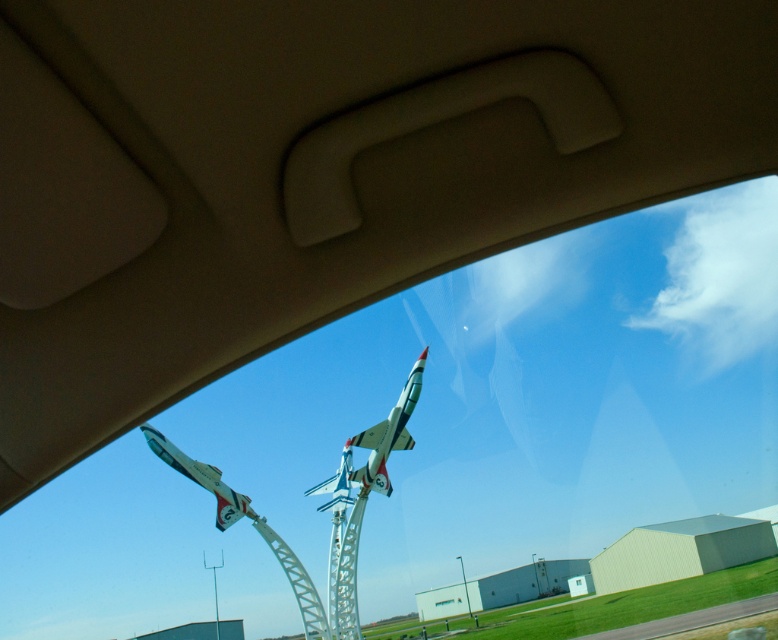
Consider the image. You are a tour guide explaining the aircraft in the museum. You need to mention both shiny metallic airplane at center and shiny metallic airplane at lower left. Which one is larger in size?

The shiny metallic airplane at center is bigger than the shiny metallic airplane at lower left.

Based on the photo, you are sitting in the driver seat of the car and looking through the windshield. There is a shiny metallic airplane at center marked by point (375, 445). Which direction should you turn your head to look at the shiny metallic airplane at center?

The point (375, 445) marks the shiny metallic airplane at center, so you should look straight ahead to see it.

You are a tour guide explaining the aircraft in the museum. You mention both the shiny metallic airplane at center and the shiny metallic airplane at lower left. Which one is wider?

The shiny metallic airplane at center is wider than the shiny metallic airplane at lower left.